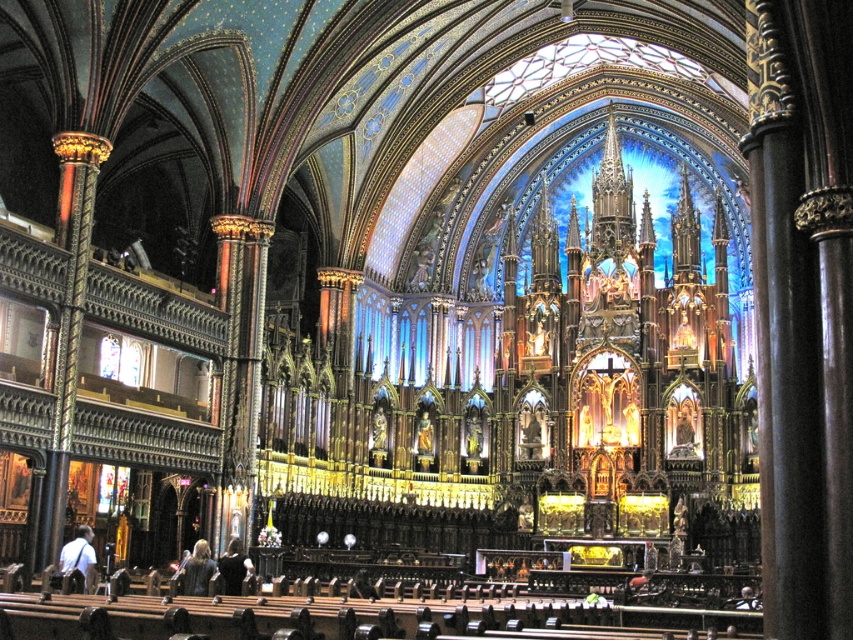
You are standing inside the cathedral and notice two points marked in the scene. Point A is at coordinates point [62,566] and Point B is at point [236,545]. Which point is closer to your current position?

Point A at point [62,566] is closer to the camera than point [236,545], so Point A is closer to your current position.

You are standing inside the cathedral and want to know how far you are from the point labeled as point (207, 570). Can you determine this distance based on the information provided?

The distance between point (207, 570) and the camera is 65.28 meters, so you are 65.28 meters away from point (207, 570).

You are standing in the cathedral and want to pick up both the white fabric bag at lower left and the dark brown leather jacket at lower center. Which item should you reach for first to grab the one closer to you?

The white fabric bag at lower left is closer to the viewer than the dark brown leather jacket at lower center, so you should reach for the white fabric bag at lower left first.